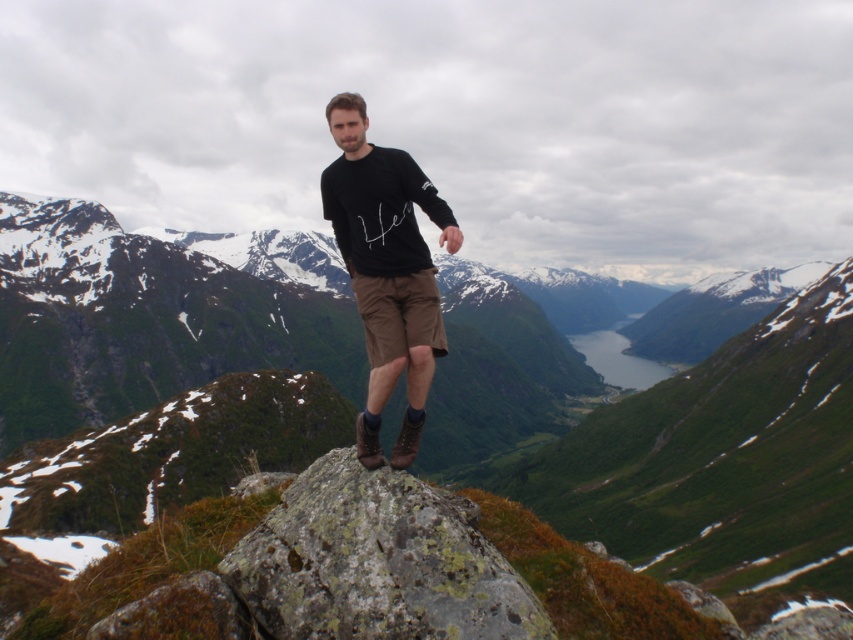
Question: Which of the following is the farthest from the observer?

Choices:
 (A) black cotton shirt at center
 (B) rugged stone mountain at center
 (C) rusty rock at center

Answer: (B)

Question: Which of the following is the farthest from the observer?

Choices:
 (A) rusty rock at center
 (B) rugged stone mountain at center

Answer: (B)

Question: Which object is positioned farthest from the rusty rock at center?

Choices:
 (A) rugged stone mountain at center
 (B) black cotton shirt at center

Answer: (A)

Question: Is rusty rock at center further to camera compared to black cotton shirt at center?

Choices:
 (A) no
 (B) yes

Answer: (A)

Question: Does rugged stone mountain at center appear over rusty rock at center?

Choices:
 (A) yes
 (B) no

Answer: (A)

Question: Can you confirm if rugged stone mountain at center is positioned below black cotton shirt at center?

Choices:
 (A) no
 (B) yes

Answer: (A)